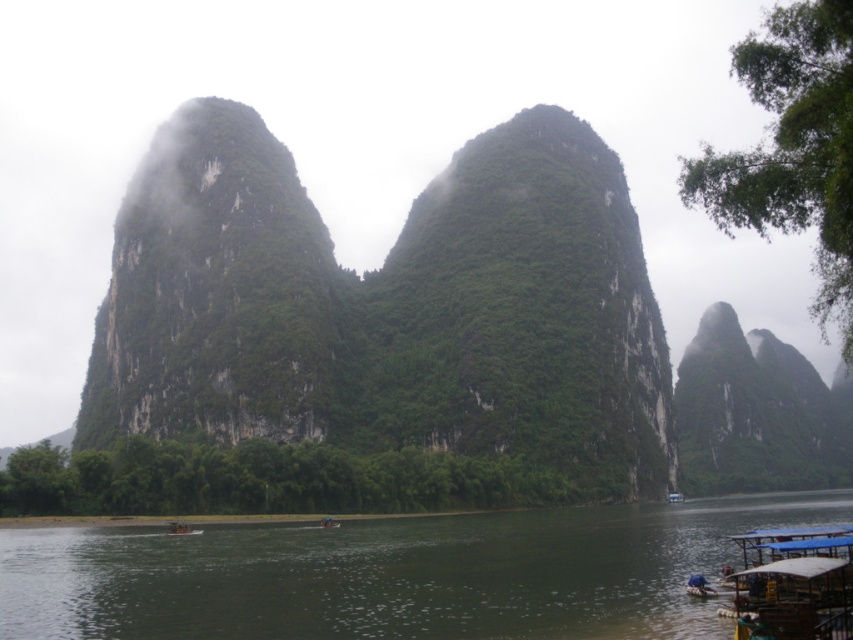
Who is positioned more to the left, green rock formation at center or green textured rock at right?

green rock formation at center is more to the left.

Who is shorter, green rock formation at center or green textured rock at right?

green textured rock at right is shorter.

Is point (279, 202) positioned behind point (741, 390)?

No, (279, 202) is closer to viewer.

The width and height of the screenshot is (853, 640). Identify the location of green rock formation at center. (387, 307).

Which is above, green textured rock at right or wooden boat at lower center?

wooden boat at lower center is above.

This screenshot has height=640, width=853. Identify the location of green textured rock at right. (755, 413).

Who is more forward, (714, 314) or (181, 532)?

Point (181, 532) is more forward.

Where is `green textured rock at right`? Image resolution: width=853 pixels, height=640 pixels. green textured rock at right is located at coordinates (755, 413).

Is point (543, 348) behind point (177, 529)?

Yes, it is.

Is point (339, 384) behind point (170, 534)?

Yes, point (339, 384) is behind point (170, 534).

Locate an element on the screen. The height and width of the screenshot is (640, 853). green rock formation at center is located at coordinates (387, 307).